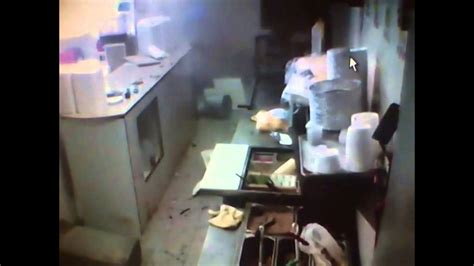
I want to click on storage, so click(244, 165).